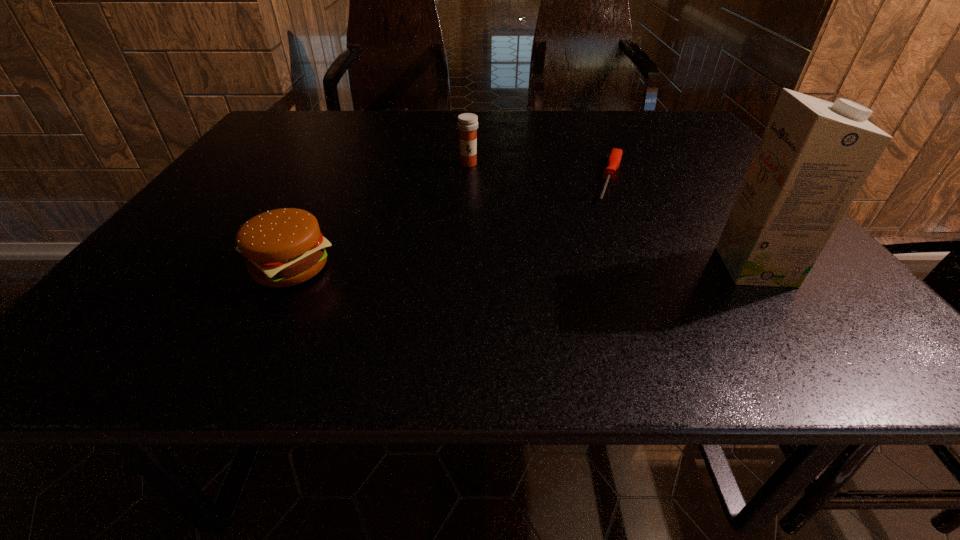
Find the location of a particular element. Image resolution: width=960 pixels, height=540 pixels. free spot on the desktop that is between the hamburger and the tallest object and is positioned on the label side of the third object from right to left is located at coordinates (464, 267).

Where is `free space on the desktop that is between the leftmost object and the rightmost object and is positioned at the tip of the second object from right to left`? This screenshot has width=960, height=540. free space on the desktop that is between the leftmost object and the rightmost object and is positioned at the tip of the second object from right to left is located at coordinates (581, 267).